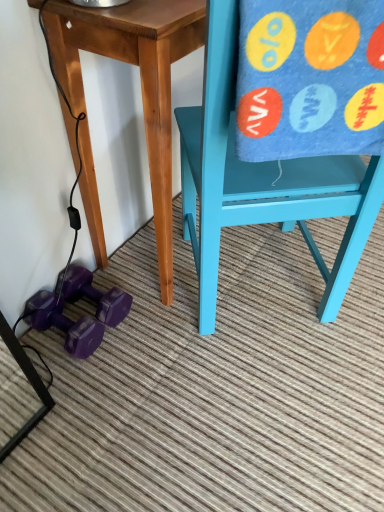
The width and height of the screenshot is (384, 512). In order to click on free space in front of purple rubber dumbbell at lower left, which ranks as the 1th dumbbell in top-to-bottom order in this screenshot , I will do `click(96, 369)`.